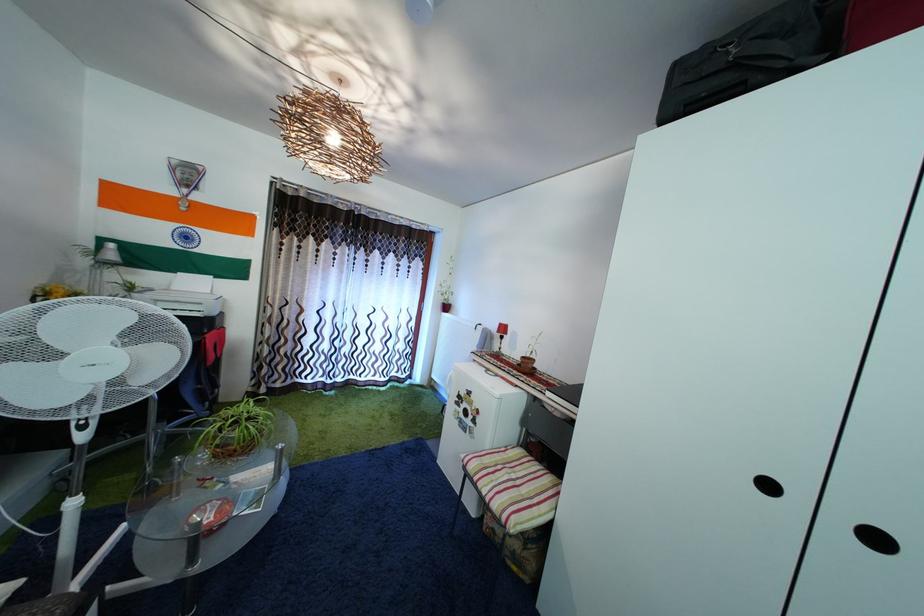
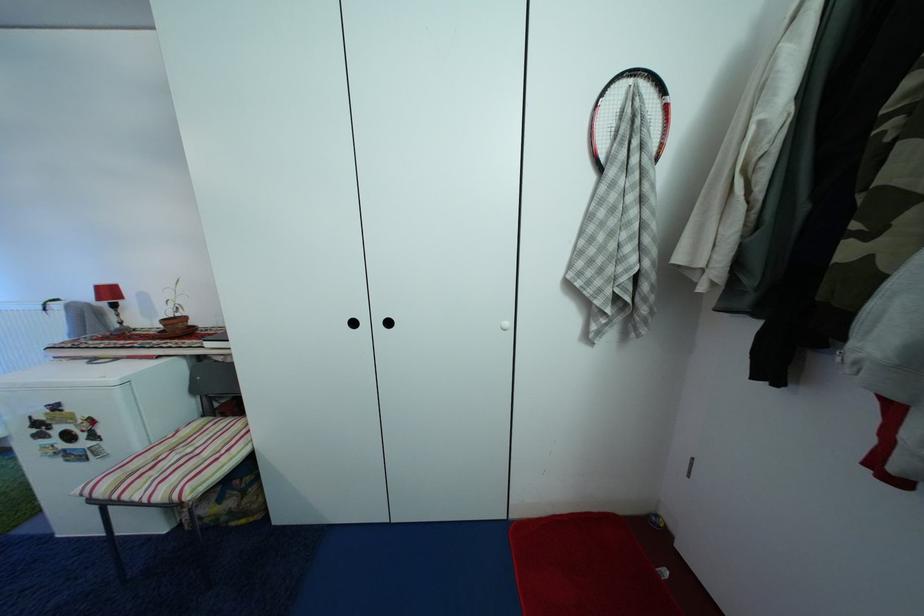
The point at (531,365) is marked in the first image. Where is the corresponding point in the second image?

(174, 326)